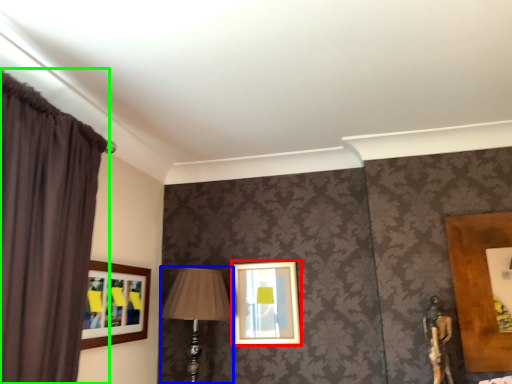
Question: Which object is the farthest from picture frame (highlighted by a red box)? Choose among these: table lamp (highlighted by a blue box) or curtain (highlighted by a green box).

Choices:
 (A) table lamp
 (B) curtain

Answer: (B)